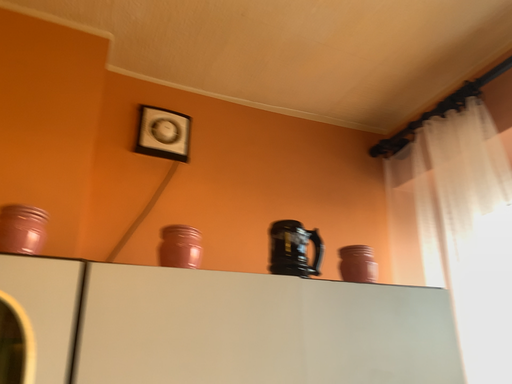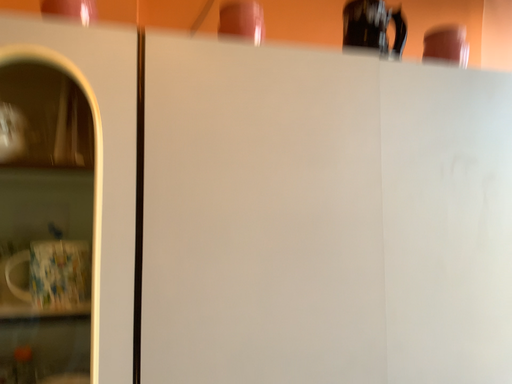
Question: Which way did the camera rotate in the video?

Choices:
 (A) rotated left
 (B) rotated right

Answer: (A)